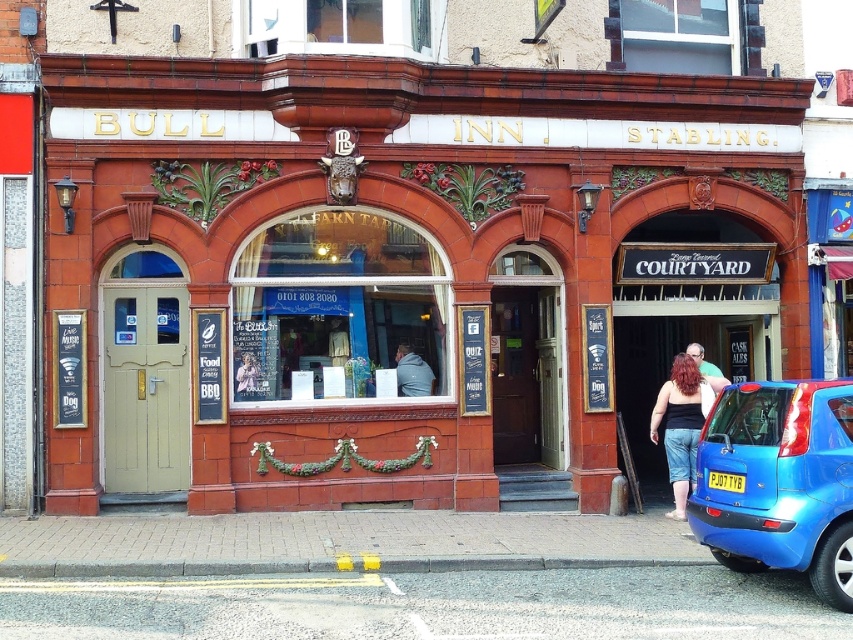
You are a customer looking for the entrance to the courtyard at the Bull Inn Stabling. You see a matte black tank top at center and a yellow plastic license plate at lower center. Which entrance should you approach based on their positions?

The matte black tank top at center is located below the yellow plastic license plate at lower center, so the entrance with the yellow plastic license plate at lower center is the one leading to the courtyard.

You are standing in front of the Bull Inn Stabling. If you want to locate the red brick building at center, where should you look?

The red brick building at center is located at the coordinates point (387, 260).